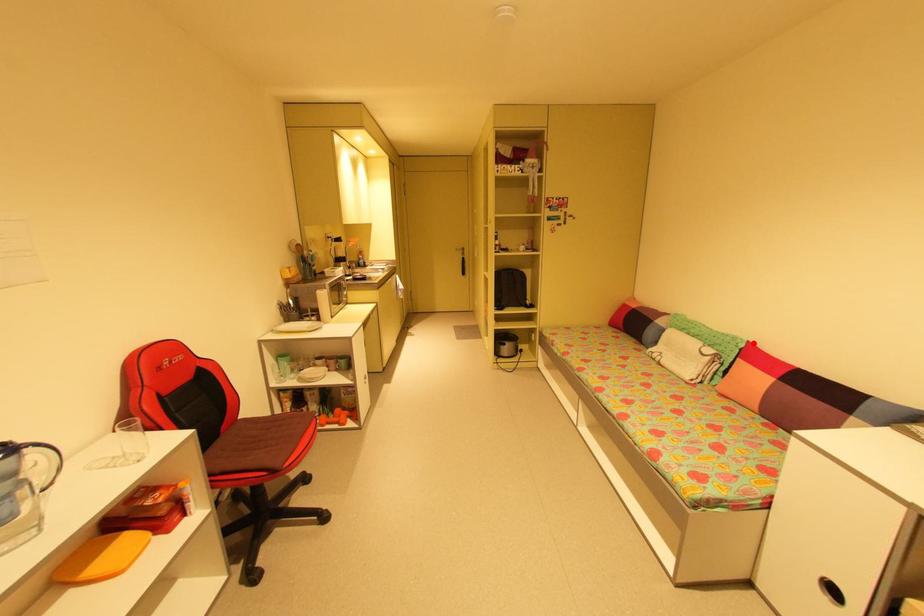
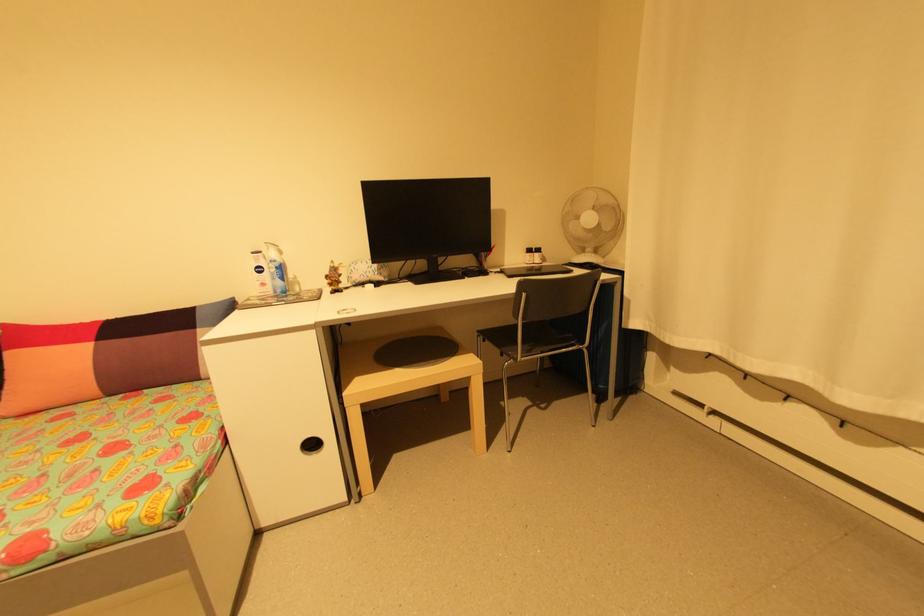
Find the pixel in the second image that matches the highlighted location in the first image.

(8, 326)